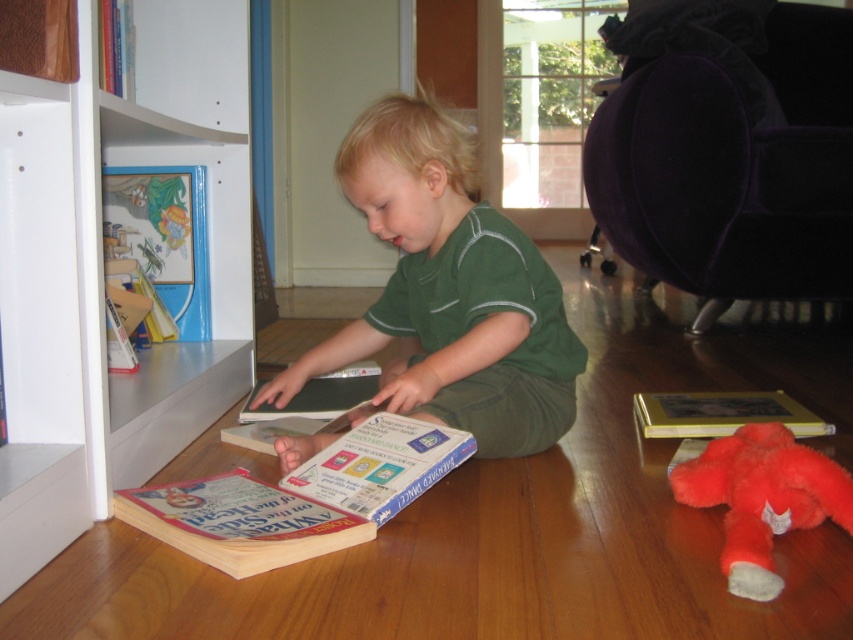
Looking at this image, you are a photographer taking a picture of the scene. You want to ensure both the green matte shirt at center and the fluffy red stuffed animal at lower right are clearly visible. Based on their positions, which object is closer to the left side of the frame?

The green matte shirt at center is to the left of the fluffy red stuffed animal at lower right, so it is closer to the left side of the frame.

You are a photographer taking a picture of the scene. You want to focus on the point closer to the camera. Which point should you choose between point (224, 557) and point (735, 544)?

Point (224, 557) is closer to the camera than point (735, 544), so you should choose point (224, 557) to focus on.